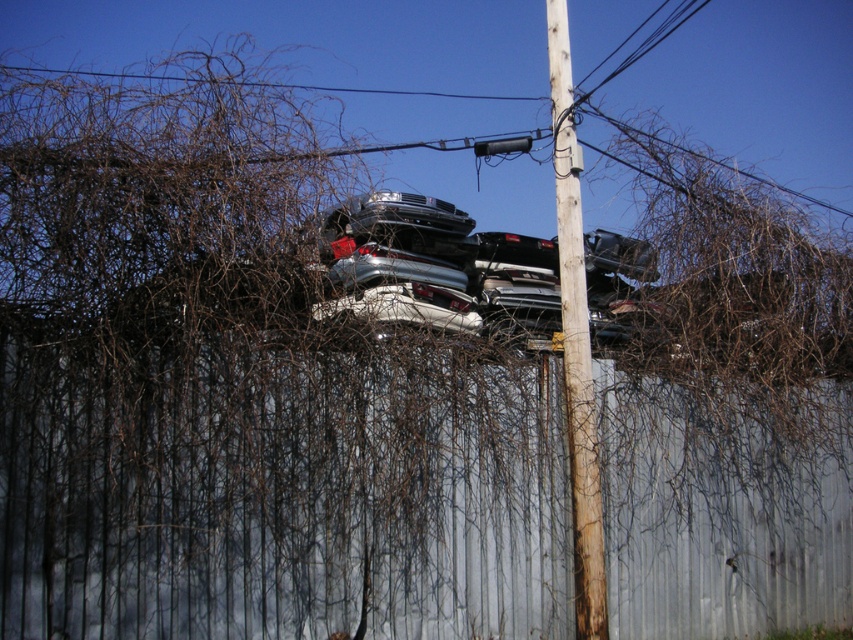
Is metallic gray fence at upper center to the right of wooden telephone pole at center from the viewer's perspective?

No, metallic gray fence at upper center is not to the right of wooden telephone pole at center.

Is metallic gray fence at upper center thinner than wooden telephone pole at center?

In fact, metallic gray fence at upper center might be wider than wooden telephone pole at center.

Is point (344, 580) in front of point (573, 216)?

Yes.

Where is `metallic gray fence at upper center`? The height and width of the screenshot is (640, 853). metallic gray fence at upper center is located at coordinates (280, 493).

Between wooden telephone pole at center and shiny silver car at center, which one appears on the right side from the viewer's perspective?

wooden telephone pole at center is more to the right.

Who is taller, wooden telephone pole at center or shiny silver car at center?

Standing taller between the two is wooden telephone pole at center.

This screenshot has height=640, width=853. Describe the element at coordinates (575, 342) in the screenshot. I see `wooden telephone pole at center` at that location.

This screenshot has width=853, height=640. I want to click on wooden telephone pole at center, so click(x=575, y=342).

Is metallic gray fence at upper center thinner than silver metallic car at center?

No, metallic gray fence at upper center is not thinner than silver metallic car at center.

Between metallic gray fence at upper center and silver metallic car at center, which one has less height?

Standing shorter between the two is silver metallic car at center.

Locate an element on the screen. The width and height of the screenshot is (853, 640). metallic gray fence at upper center is located at coordinates (280, 493).

Locate an element on the screen. metallic gray fence at upper center is located at coordinates (280, 493).